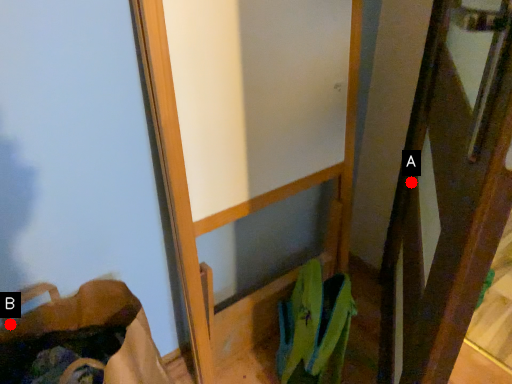
Question: Two points are circled on the image, labeled by A and B beside each circle. Which point is farther from the camera taking this photo?

Choices:
 (A) A is further
 (B) B is further

Answer: (A)